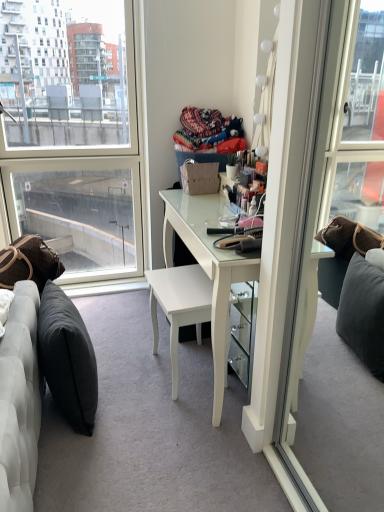
Question: From the image's perspective, is white glossy desk at center located beneath white glossy chair at center?

Choices:
 (A) yes
 (B) no

Answer: (B)

Question: Is white glossy desk at center positioned with its back to white glossy chair at center?

Choices:
 (A) no
 (B) yes

Answer: (B)

Question: Is white glossy desk at center in front of white glossy chair at center?

Choices:
 (A) yes
 (B) no

Answer: (A)

Question: Does white glossy desk at center have a greater width compared to white glossy chair at center?

Choices:
 (A) no
 (B) yes

Answer: (B)

Question: Is white glossy desk at center not within white glossy chair at center?

Choices:
 (A) yes
 (B) no

Answer: (A)

Question: Considering the positions of dark gray fabric pillow at lower left, arranged as the 1th pillow when viewed from the right, and transparent glass window at left in the image, is dark gray fabric pillow at lower left, arranged as the 1th pillow when viewed from the right, wider or thinner than transparent glass window at left?

Choices:
 (A) thin
 (B) wide

Answer: (A)

Question: Is dark gray fabric pillow at lower left, arranged as the 1th pillow when viewed from the right, bigger or smaller than transparent glass window at left?

Choices:
 (A) small
 (B) big

Answer: (A)

Question: In terms of height, does dark gray fabric pillow at lower left, the second pillow viewed from the left, look taller or shorter compared to transparent glass window at left?

Choices:
 (A) tall
 (B) short

Answer: (B)

Question: From the image's perspective, is dark gray fabric pillow at lower left, the second pillow viewed from the left, above or below transparent glass window at left?

Choices:
 (A) below
 (B) above

Answer: (A)

Question: Considering the positions of point (182, 198) and point (162, 293), is point (182, 198) closer or farther from the camera than point (162, 293)?

Choices:
 (A) closer
 (B) farther

Answer: (B)

Question: Is white glossy desk at center taller or shorter than white glossy chair at center?

Choices:
 (A) tall
 (B) short

Answer: (A)

Question: Considering the relative positions of white glossy desk at center and white glossy chair at center in the image provided, is white glossy desk at center to the left or to the right of white glossy chair at center?

Choices:
 (A) right
 (B) left

Answer: (A)

Question: From a real-world perspective, is white glossy desk at center physically located above or below white glossy chair at center?

Choices:
 (A) below
 (B) above

Answer: (B)

Question: Considering the positions of point (211, 337) and point (62, 352), is point (211, 337) closer or farther from the camera than point (62, 352)?

Choices:
 (A) farther
 (B) closer

Answer: (A)

Question: Is white glossy desk at center wider or thinner than dark gray fabric pillow at lower left, the second pillow viewed from the left?

Choices:
 (A) wide
 (B) thin

Answer: (A)